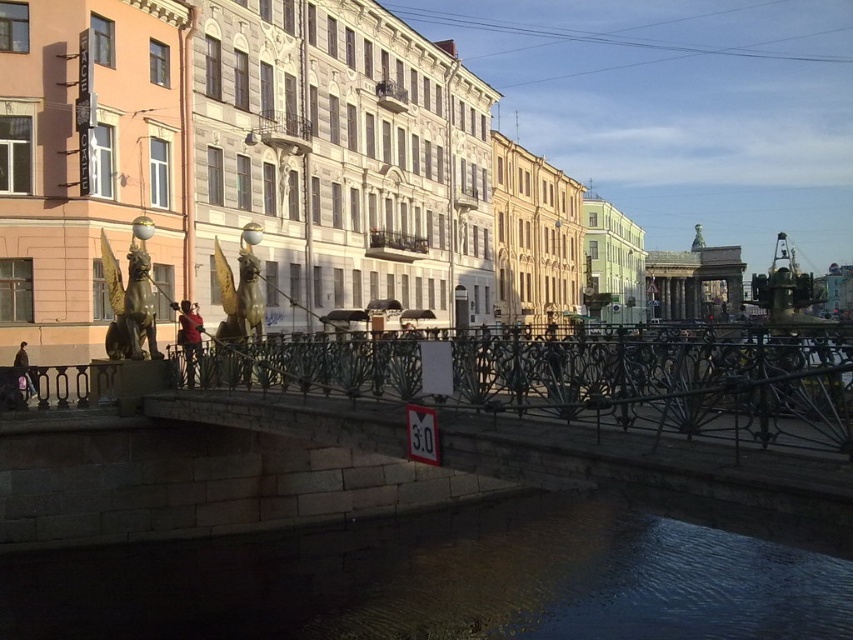
Who is shorter, dark stone water at lower center or black wrought iron fence at center?

black wrought iron fence at center

Locate an element on the screen. The width and height of the screenshot is (853, 640). dark stone water at lower center is located at coordinates (444, 580).

Does point (802, 564) come behind point (592, 413)?

Yes, point (802, 564) is behind point (592, 413).

You are a GUI agent. You are given a task and a screenshot of the screen. Output one action in this format:
    pyautogui.click(x=<x>, y=<y>)
    Task: Click on the dark stone water at lower center
    This screenshot has height=640, width=853.
    Given the screenshot: What is the action you would take?
    pyautogui.click(x=444, y=580)